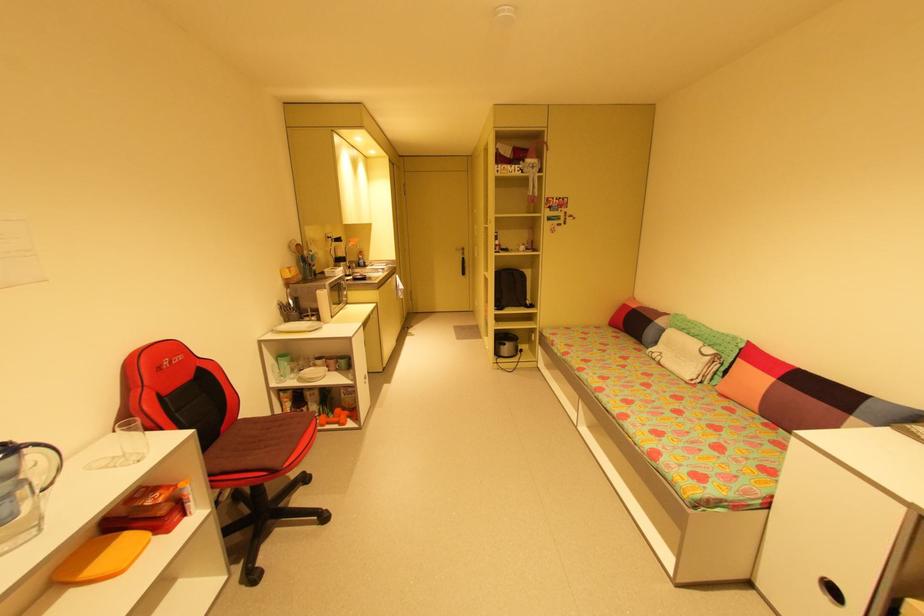
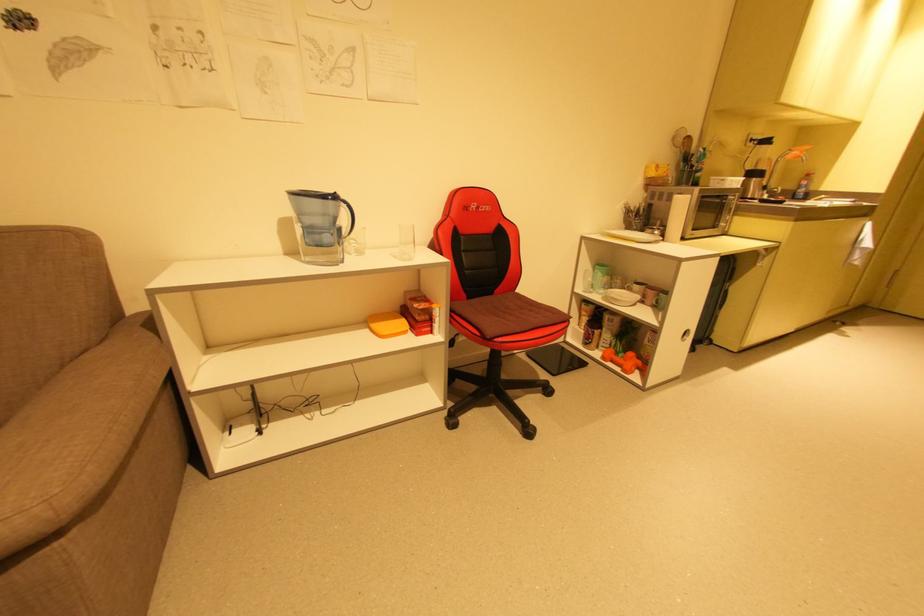
Find the pixel in the second image that matches (x=30, y=450) in the first image.

(346, 204)